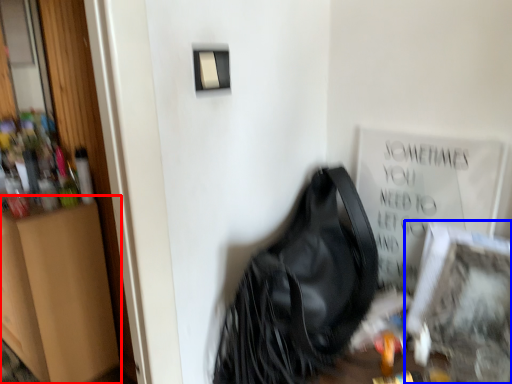
Question: Which point is closer to the camera, dresser (highlighted by a red box) or picture frame (highlighted by a blue box)?

Choices:
 (A) dresser
 (B) picture frame

Answer: (B)